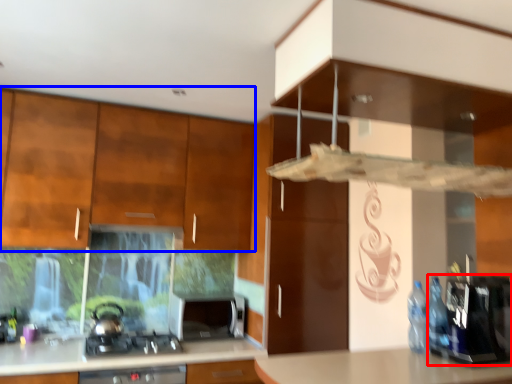
Question: Which object is closer to the camera taking this photo, appliance (highlighted by a red box) or cabinetry (highlighted by a blue box)?

Choices:
 (A) appliance
 (B) cabinetry

Answer: (A)